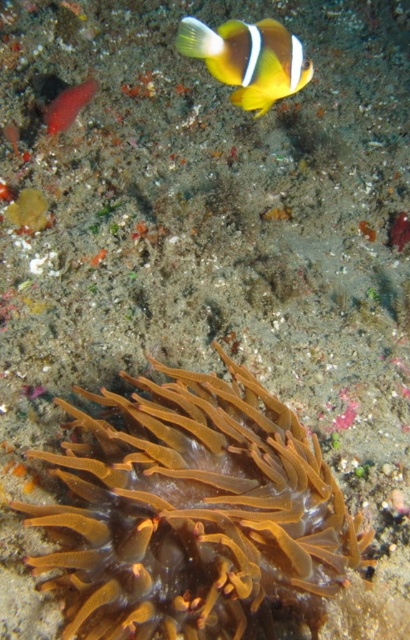
Is point (202, 636) positioned before point (86, 90)?

Yes.

Locate an element on the screen. This screenshot has height=640, width=410. orange translucent anemone at bottom is located at coordinates 193,509.

Is yellow matte clownfish at upper center positioned behind smooth pinkish coral at upper left?

No, yellow matte clownfish at upper center is in front of smooth pinkish coral at upper left.

Can you confirm if yellow matte clownfish at upper center is positioned below smooth pinkish coral at upper left?

Yes.

At what (x,y) coordinates should I click in order to perform the action: click on yellow matte clownfish at upper center. Please return your answer as a coordinate pair (x, y). The width and height of the screenshot is (410, 640). Looking at the image, I should click on (248, 58).

Consider the image. Is orange translucent anemone at bottom taller than yellow matte clownfish at upper center?

Correct, orange translucent anemone at bottom is much taller as yellow matte clownfish at upper center.

Is point (293, 598) closer to viewer compared to point (259, 26)?

No, it is behind (259, 26).

Is point (300, 576) closer to viewer compared to point (280, 52)?

No, it is behind (280, 52).

Where is `orange translucent anemone at bottom`? The width and height of the screenshot is (410, 640). orange translucent anemone at bottom is located at coordinates (193, 509).